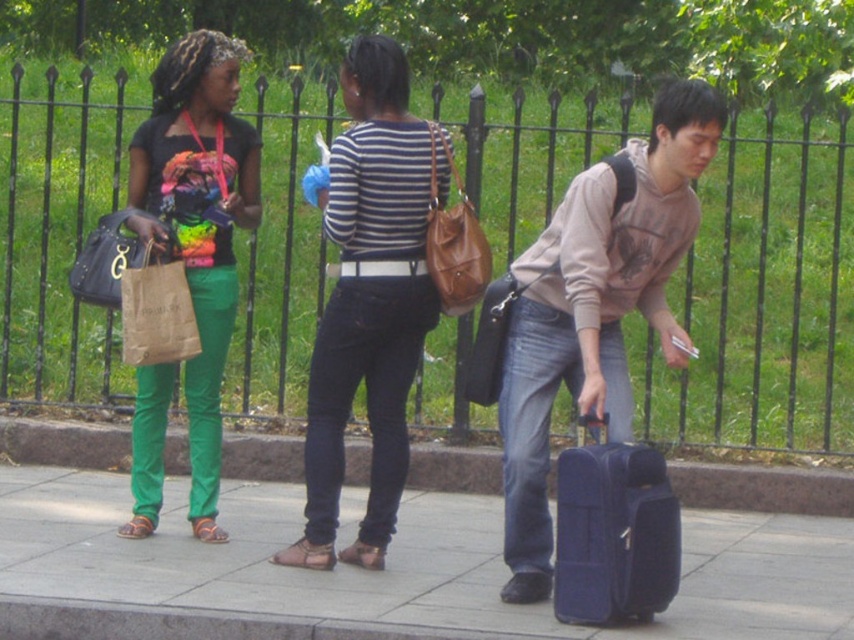
You are a delivery person who needs to place a package on the sidewalk between the black metal fence at upper center and the blue fabric suitcase at lower right. Can you fit the package there?

The black metal fence at upper center is to the left of the blue fabric suitcase at lower right, so there is space between them for the package.

You are a delivery person who needs to place a large package on the ground without covering any objects. Given the scene, can you place the package on the smooth concrete pavement at center without overlapping the matte black shirt at left?

The smooth concrete pavement at center is larger in size than the matte black shirt at left, so yes, you can place the package on the smooth concrete pavement at center without overlapping the matte black shirt at left because it has enough space.